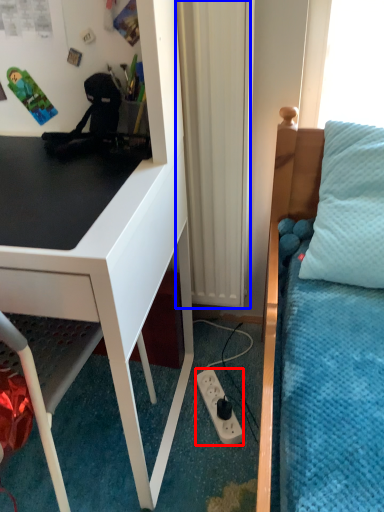
Question: Which object is closer to the camera taking this photo, power outlet (highlighted by a red box) or curtain (highlighted by a blue box)?

Choices:
 (A) power outlet
 (B) curtain

Answer: (B)